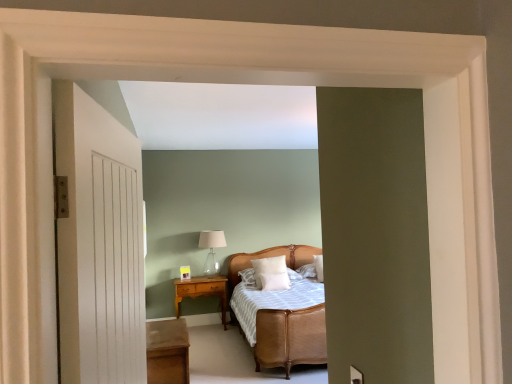
Question: Is wooden nightstand at center closer to camera compared to white soft pillow at center, acting as the 2th pillow starting from the right?

Choices:
 (A) yes
 (B) no

Answer: (B)

Question: From a real-world perspective, does wooden nightstand at center stand above white soft pillow at center, acting as the 2th pillow starting from the right?

Choices:
 (A) no
 (B) yes

Answer: (A)

Question: From a real-world perspective, does wooden nightstand at center sit lower than white soft pillow at center, acting as the 2th pillow starting from the right?

Choices:
 (A) no
 (B) yes

Answer: (B)

Question: Does wooden nightstand at center turn towards white soft pillow at center, acting as the 2th pillow starting from the right?

Choices:
 (A) no
 (B) yes

Answer: (A)

Question: Is wooden nightstand at center at the right side of white soft pillow at center, which is the 2th pillow in left-to-right order?

Choices:
 (A) yes
 (B) no

Answer: (B)

Question: From the image's perspective, relative to white wooden door at left, is clear glass table lamp at center above or below?

Choices:
 (A) below
 (B) above

Answer: (A)

Question: Considering the positions of clear glass table lamp at center and white wooden door at left in the image, is clear glass table lamp at center taller or shorter than white wooden door at left?

Choices:
 (A) tall
 (B) short

Answer: (B)

Question: In the image, is clear glass table lamp at center on the left side or the right side of white wooden door at left?

Choices:
 (A) left
 (B) right

Answer: (A)

Question: Relative to white wooden door at left, is clear glass table lamp at center in front or behind?

Choices:
 (A) front
 (B) behind

Answer: (B)

Question: Does point (224, 311) appear closer or farther from the camera than point (281, 273)?

Choices:
 (A) farther
 (B) closer

Answer: (A)

Question: Looking at their shapes, would you say wooden nightstand at center is wider or thinner than white soft pillow at center, the 3th pillow in the right-to-left sequence?

Choices:
 (A) thin
 (B) wide

Answer: (B)

Question: Which is correct: wooden nightstand at center is inside white soft pillow at center, positioned as the first pillow in left-to-right order, or outside of it?

Choices:
 (A) inside
 (B) outside

Answer: (B)

Question: Considering the positions of wooden nightstand at center and white soft pillow at center, positioned as the first pillow in left-to-right order, in the image, is wooden nightstand at center taller or shorter than white soft pillow at center, positioned as the first pillow in left-to-right order,?

Choices:
 (A) short
 (B) tall

Answer: (B)

Question: In the image, is white wooden door at left positioned in front of or behind wooden table at lower left?

Choices:
 (A) front
 (B) behind

Answer: (A)

Question: Is white wooden door at left bigger or smaller than wooden table at lower left?

Choices:
 (A) big
 (B) small

Answer: (B)